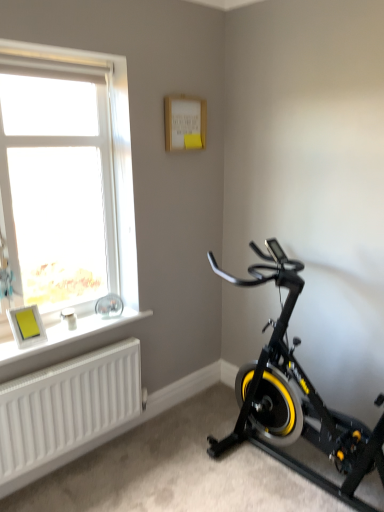
Identify the location of free location to the left of black matte stationary bicycle at lower right. The width and height of the screenshot is (384, 512). (181, 474).